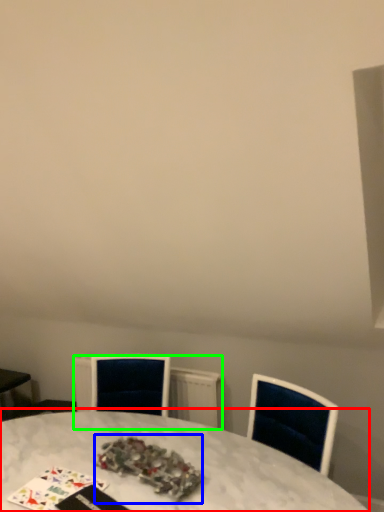
Question: Based on their relative distances, which object is nearer to table (highlighted by a red box)? Choose from christmas decoration (highlighted by a blue box) and radiator (highlighted by a green box).

Choices:
 (A) christmas decoration
 (B) radiator

Answer: (A)